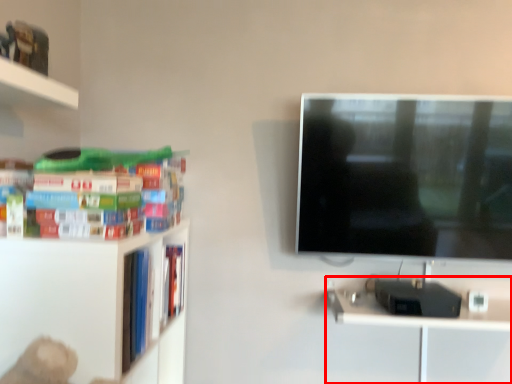
Question: Considering the relative positions of computer desk (annotated by the red box) and book in the image provided, where is computer desk (annotated by the red box) located with respect to the staircase?

Choices:
 (A) right
 (B) left

Answer: (A)